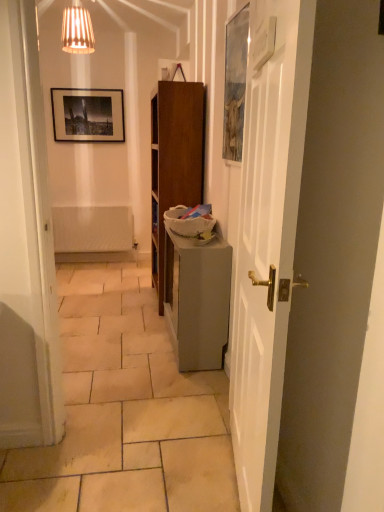
Question: Should I look upward or downward to see white wooden door at right?

Choices:
 (A) up
 (B) down

Answer: (B)

Question: Does matte gray table at center have a larger size compared to white wooden door at right?

Choices:
 (A) yes
 (B) no

Answer: (A)

Question: Is matte gray table at center not near white wooden door at right?

Choices:
 (A) no
 (B) yes

Answer: (A)

Question: Considering the relative positions of matte gray table at center and white wooden door at right in the image provided, is matte gray table at center behind white wooden door at right?

Choices:
 (A) no
 (B) yes

Answer: (B)

Question: From the image's perspective, is matte gray table at center under white wooden door at right?

Choices:
 (A) no
 (B) yes

Answer: (B)

Question: From a real-world perspective, is matte gray table at center under white wooden door at right?

Choices:
 (A) no
 (B) yes

Answer: (B)

Question: Considering the relative sizes of matte gray table at center and white wooden door at right in the image provided, is matte gray table at center smaller than white wooden door at right?

Choices:
 (A) yes
 (B) no

Answer: (B)

Question: Is white wooden door at right positioned beyond the bounds of matte gray table at center?

Choices:
 (A) yes
 (B) no

Answer: (A)

Question: Does white wooden door at right have a greater width compared to matte gray table at center?

Choices:
 (A) yes
 (B) no

Answer: (B)

Question: Is white wooden door at right shorter than matte gray table at center?

Choices:
 (A) no
 (B) yes

Answer: (A)

Question: Is white wooden door at right positioned behind matte gray table at center?

Choices:
 (A) no
 (B) yes

Answer: (A)

Question: From the image's perspective, does white wooden door at right appear lower than matte gray table at center?

Choices:
 (A) yes
 (B) no

Answer: (B)

Question: Is white wooden door at right closer to camera compared to matte gray table at center?

Choices:
 (A) no
 (B) yes

Answer: (B)

Question: Is point (193, 356) positioned closer to the camera than point (244, 217)?

Choices:
 (A) farther
 (B) closer

Answer: (A)